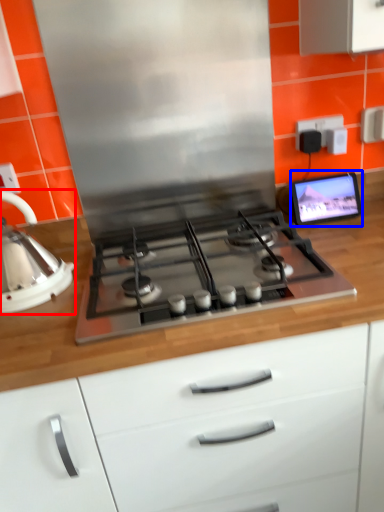
Question: Which object is closer to the camera taking this photo, kitchen appliance (highlighted by a red box) or computer monitor (highlighted by a blue box)?

Choices:
 (A) kitchen appliance
 (B) computer monitor

Answer: (A)